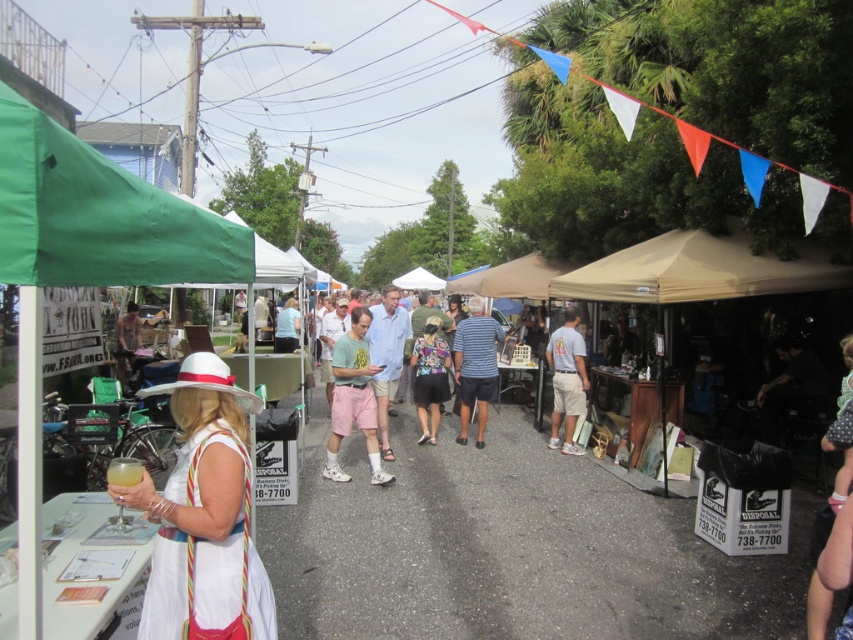
Question: Which point appears farthest from the camera in this image?

Choices:
 (A) (165, 547)
 (B) (163, 224)

Answer: (A)

Question: Is pink cotton shorts at center smaller than floral-patterned fabric skirt at center?

Choices:
 (A) yes
 (B) no

Answer: (B)

Question: Is white cotton dress at center above floral-patterned fabric skirt at center?

Choices:
 (A) no
 (B) yes

Answer: (B)

Question: Does pink cotton shorts at center have a greater width compared to striped cotton shirt at center?

Choices:
 (A) yes
 (B) no

Answer: (A)

Question: Which point is closer to the camera taking this photo?

Choices:
 (A) (3, 179)
 (B) (563, 371)

Answer: (A)

Question: Among these objects, which one is nearest to the camera?

Choices:
 (A) white cotton dress at center
 (B) pink cotton shorts at center

Answer: (A)